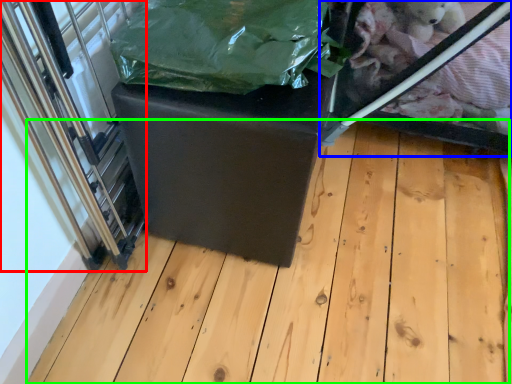
Question: Which object is the farthest from glass door (highlighted by a red box)? Choose among these: glass box (highlighted by a blue box) or wood (highlighted by a green box).

Choices:
 (A) glass box
 (B) wood

Answer: (A)